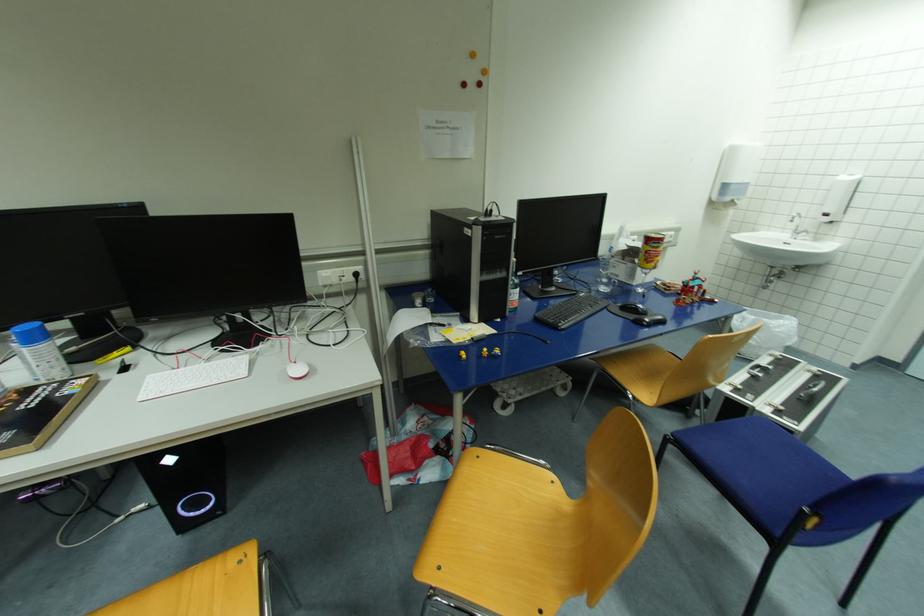
Locate an element on the screen. The image size is (924, 616). blue chair sitting surface is located at coordinates (779, 476).